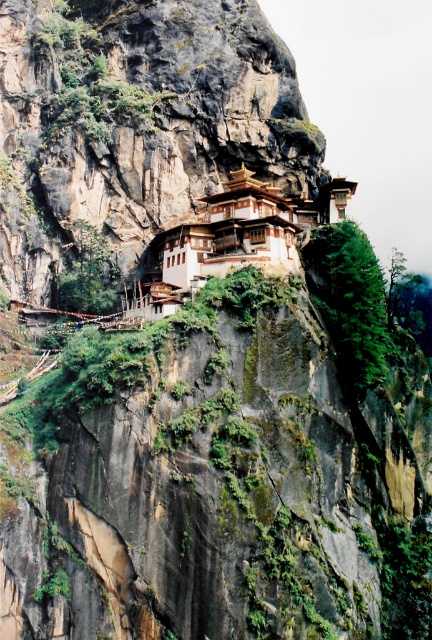
Does brown wooden structure at center lie in front of brown wooden monastery at center?

No, brown wooden structure at center is behind brown wooden monastery at center.

Based on the photo, between brown wooden structure at center and brown wooden monastery at center, which one has more height?

brown wooden structure at center is taller.

Does point (250, 102) lie behind point (250, 211)?

Yes, it is.

Find the location of a particular element. The width and height of the screenshot is (432, 640). brown wooden structure at center is located at coordinates (136, 122).